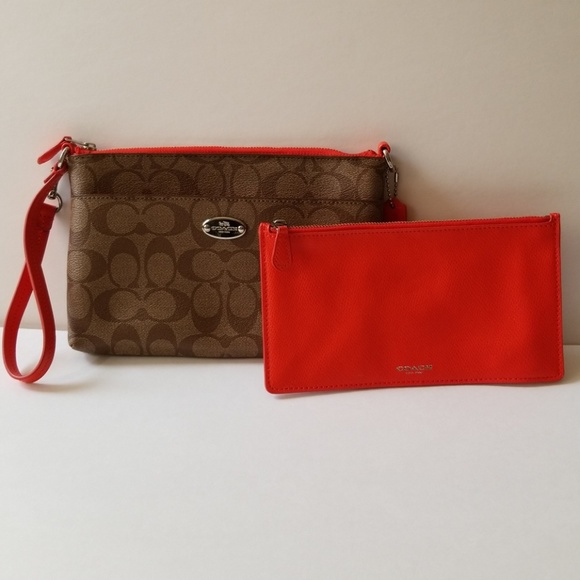
Identify the location of surface. Image resolution: width=580 pixels, height=580 pixels. click(447, 445).